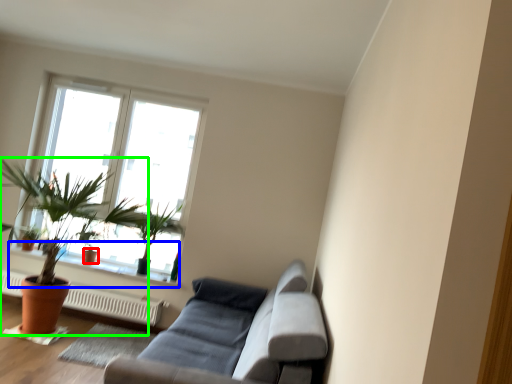
Question: Considering the real-world distances, which object is farthest from flowerpot (highlighted by a red box)? window sill (highlighted by a blue box) or houseplant (highlighted by a green box)?

Choices:
 (A) window sill
 (B) houseplant

Answer: (B)